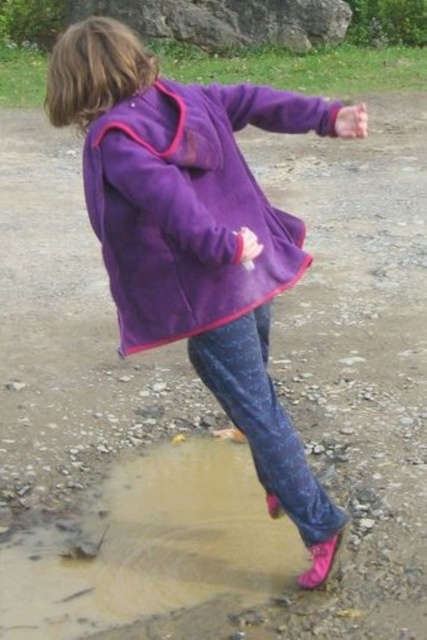
Is purple fleece jacket at center in front of smooth gray rock at upper center?

Yes, purple fleece jacket at center is in front of smooth gray rock at upper center.

Who is more distant from viewer, (260,269) or (227,13)?

The point (227,13) is more distant.

At what (x,y) coordinates should I click in order to perform the action: click on purple fleece jacket at center. Please return your answer as a coordinate pair (x, y). Looking at the image, I should click on pos(190,205).